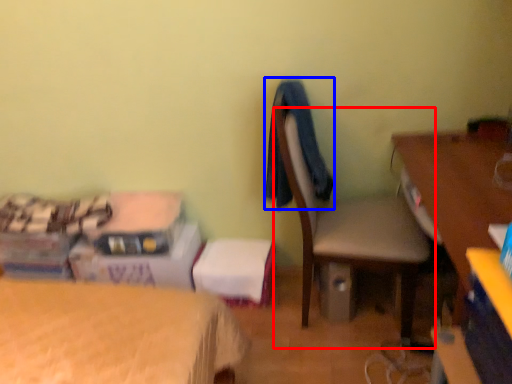
Question: Which of the following is the closest to the observer, chair (highlighted by a red box) or clothing (highlighted by a blue box)?

Choices:
 (A) chair
 (B) clothing

Answer: (A)